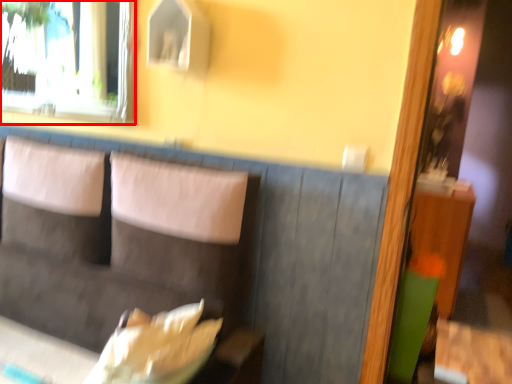
Question: From the image's perspective, what is the correct spatial relationship of window (annotated by the red box) in relation to couch?

Choices:
 (A) below
 (B) above

Answer: (B)